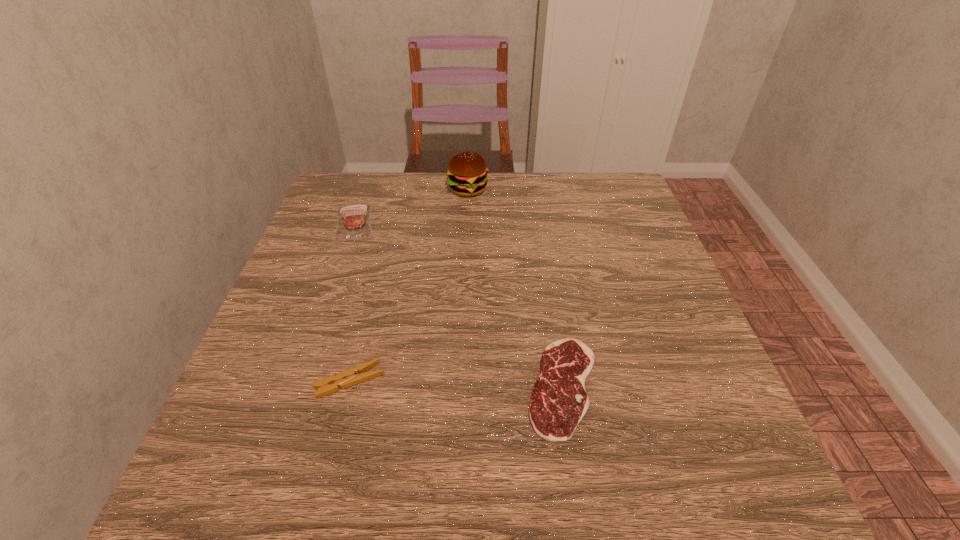
Where is `vacant area that lies between the left steak and the hamburger`? Image resolution: width=960 pixels, height=540 pixels. vacant area that lies between the left steak and the hamburger is located at coordinates (411, 206).

At what (x,y) coordinates should I click in order to perform the action: click on vacant point located between the farther steak and the clothespin. Please return your answer as a coordinate pair (x, y). The image size is (960, 540). Looking at the image, I should click on (352, 301).

Find the location of a particular element. This screenshot has width=960, height=540. object that is the third closest to the tallest object is located at coordinates (357, 374).

This screenshot has width=960, height=540. Find the location of `object that stands as the closest to the left steak`. object that stands as the closest to the left steak is located at coordinates (467, 172).

Locate an element on the screen. Image resolution: width=960 pixels, height=540 pixels. free space that satisfies the following two spatial constraints: 1. on the back side of the hamburger; 2. on the left side of the clothespin is located at coordinates (398, 190).

Find the location of `free location that satisfies the following two spatial constraints: 1. on the back side of the clothespin; 2. on the left side of the farthest object`. free location that satisfies the following two spatial constraints: 1. on the back side of the clothespin; 2. on the left side of the farthest object is located at coordinates (398, 190).

Find the location of a particular element. vacant point that satisfies the following two spatial constraints: 1. on the front side of the clothespin; 2. on the right side of the taller steak is located at coordinates (299, 381).